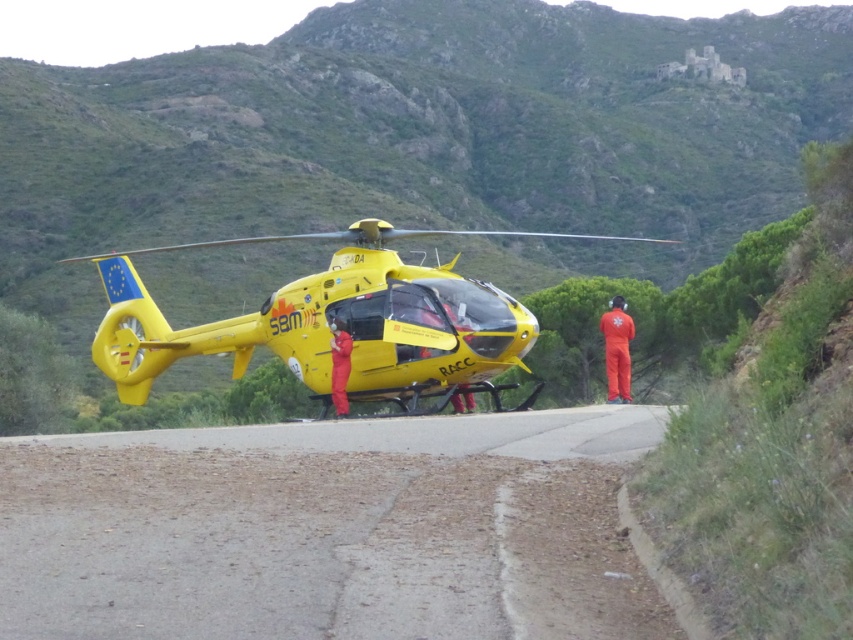
Question: Which object appears closest to the camera in this image?

Choices:
 (A) orange jumpsuit at right
 (B) yellow-orange jumpsuit at center
 (C) asphalt road at center

Answer: (C)

Question: Does asphalt road at center come in front of yellow-orange jumpsuit at center?

Choices:
 (A) no
 (B) yes

Answer: (B)

Question: Which of the following is the farthest from the observer?

Choices:
 (A) orange jumpsuit at right
 (B) asphalt road at center
 (C) yellow-orange jumpsuit at center
 (D) yellow matte helicopter at center

Answer: (A)

Question: Is asphalt road at center wider than yellow-orange jumpsuit at center?

Choices:
 (A) yes
 (B) no

Answer: (A)

Question: Can you confirm if yellow matte helicopter at center is smaller than orange jumpsuit at right?

Choices:
 (A) yes
 (B) no

Answer: (B)

Question: Among these points, which one is farthest from the camera?

Choices:
 (A) (375, 557)
 (B) (485, 308)
 (C) (347, 369)

Answer: (B)